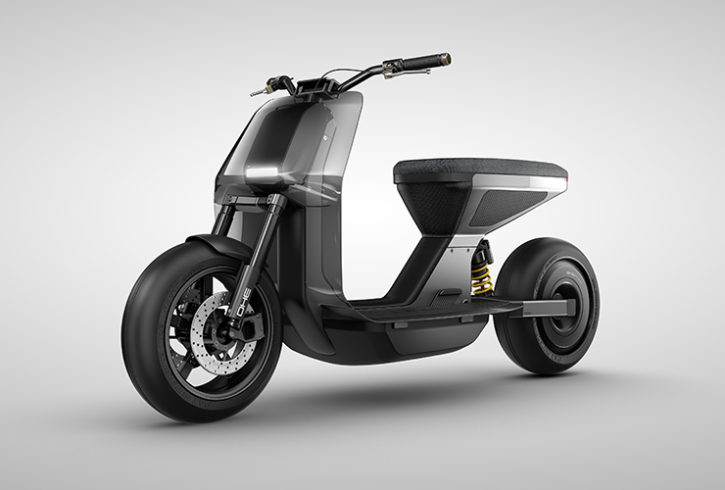
At what (x,y) coordinates should I click in order to perform the action: click on right handle. Please return your answer as a coordinate pair (x, y). Looking at the image, I should click on (270, 90).